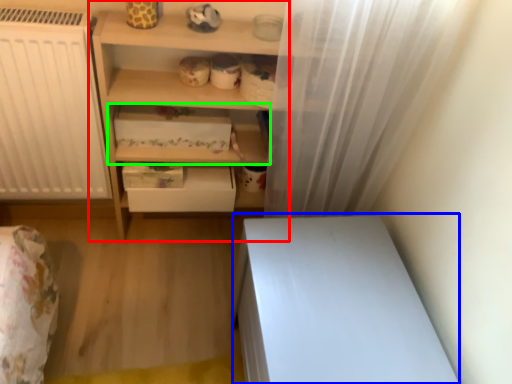
Question: Which object is positioned closest to shelf (highlighted by a red box)? Select from vanity (highlighted by a blue box) and shelf (highlighted by a green box).

Choices:
 (A) vanity
 (B) shelf

Answer: (B)